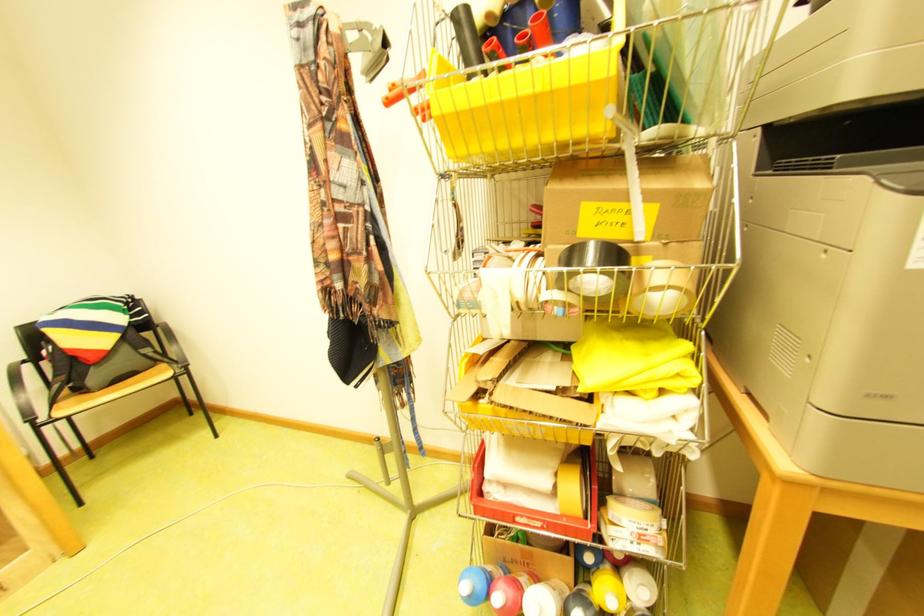
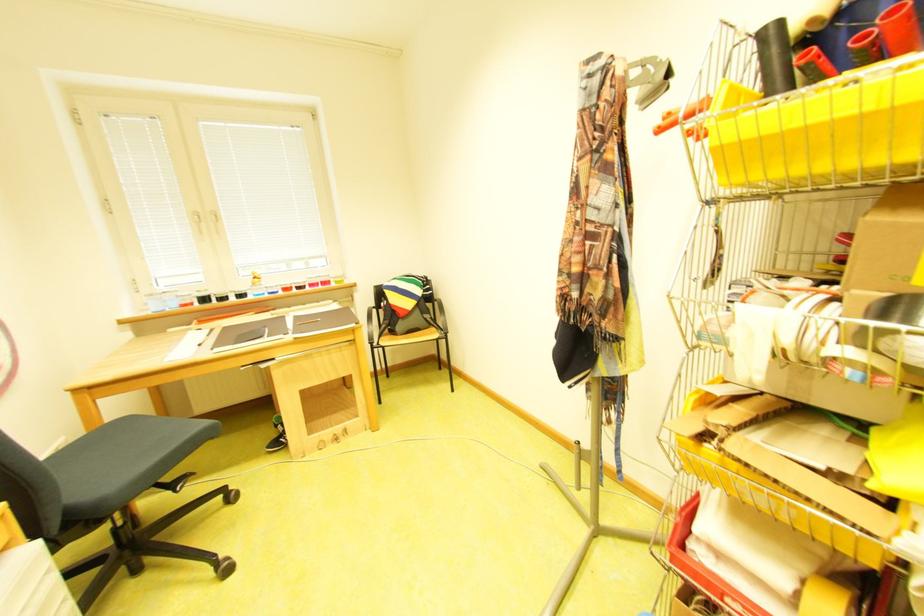
The point at [548,91] is marked in the first image. Where is the corresponding point in the second image?

(882, 108)